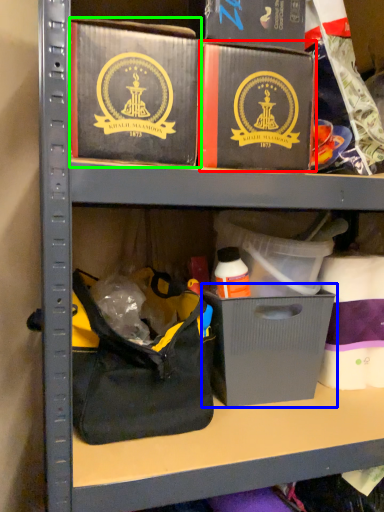
Question: Which object is positioned farthest from box (highlighted by a red box)? Select from cardboard box (highlighted by a blue box) and box (highlighted by a green box).

Choices:
 (A) cardboard box
 (B) box

Answer: (A)